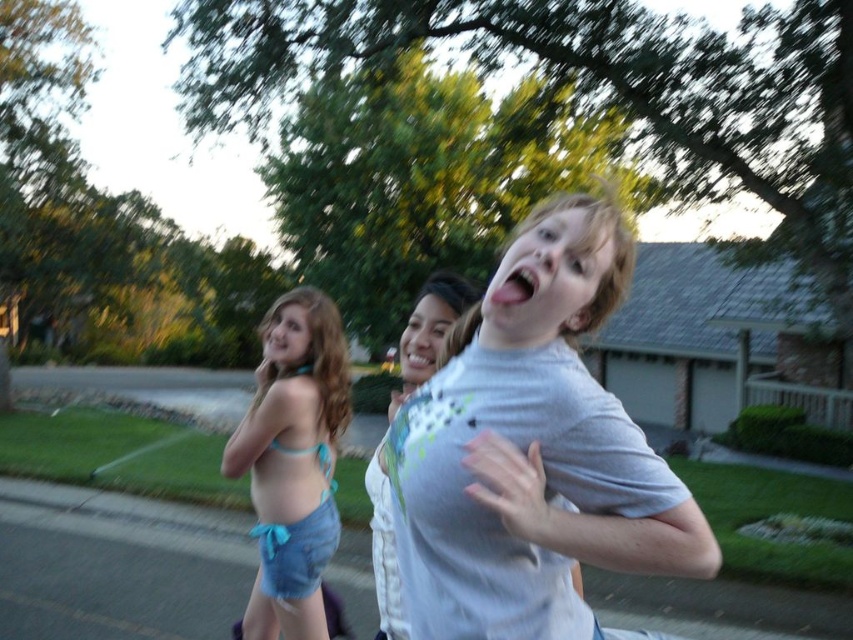
Which is below, white matte t-shirt at center or white textured shirt at center?

Positioned lower is white textured shirt at center.

Is white matte t-shirt at center thinner than white textured shirt at center?

Indeed, white matte t-shirt at center has a lesser width compared to white textured shirt at center.

Does point (576, 241) lie behind point (374, 532)?

No.

At what (x,y) coordinates should I click in order to perform the action: click on white matte t-shirt at center. Please return your answer as a coordinate pair (x, y). Looking at the image, I should click on (532, 451).

Does denim shorts at left appear on the right side of white textured shirt at center?

No, denim shorts at left is not to the right of white textured shirt at center.

Does denim shorts at left lie behind white textured shirt at center?

Yes.

This screenshot has width=853, height=640. Identify the location of denim shorts at left. (292, 461).

I want to click on denim shorts at left, so click(292, 461).

Which is in front, point (577, 301) or point (300, 531)?

Point (577, 301) is in front.

Between white matte t-shirt at center and denim shorts at left, which one is positioned higher?

white matte t-shirt at center is above.

Which is behind, point (647, 452) or point (274, 458)?

Positioned behind is point (274, 458).

Locate an element on the screen. The width and height of the screenshot is (853, 640). white matte t-shirt at center is located at coordinates (532, 451).